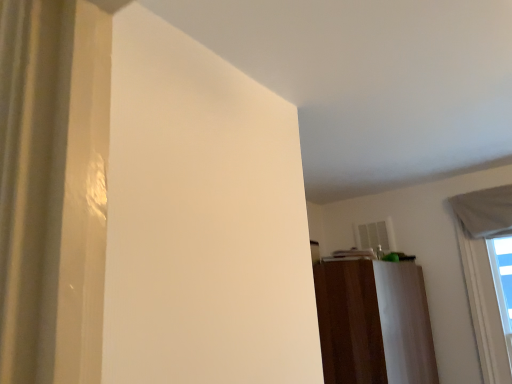
Question: From a real-world perspective, does white fabric window at upper right stand above brown wood dresser at center?

Choices:
 (A) no
 (B) yes

Answer: (B)

Question: Is white fabric window at upper right closer to the viewer compared to brown wood dresser at center?

Choices:
 (A) yes
 (B) no

Answer: (B)

Question: Is white fabric window at upper right bigger than brown wood dresser at center?

Choices:
 (A) yes
 (B) no

Answer: (B)

Question: Is white fabric window at upper right next to brown wood dresser at center and touching it?

Choices:
 (A) no
 (B) yes

Answer: (A)

Question: Is white fabric window at upper right taller than brown wood dresser at center?

Choices:
 (A) no
 (B) yes

Answer: (B)

Question: Is brown wood dresser at center surrounded by white fabric window at upper right?

Choices:
 (A) yes
 (B) no

Answer: (B)

Question: From a real-world perspective, does brown wood dresser at center sit lower than white fabric window at upper right?

Choices:
 (A) yes
 (B) no

Answer: (A)

Question: Does brown wood dresser at center lie behind white fabric window at upper right?

Choices:
 (A) yes
 (B) no

Answer: (B)

Question: From the image's perspective, is brown wood dresser at center on top of white fabric window at upper right?

Choices:
 (A) no
 (B) yes

Answer: (A)

Question: Can you confirm if brown wood dresser at center is wider than white fabric window at upper right?

Choices:
 (A) no
 (B) yes

Answer: (B)

Question: Can we say brown wood dresser at center lies outside white fabric window at upper right?

Choices:
 (A) no
 (B) yes

Answer: (B)

Question: Does brown wood dresser at center have a smaller size compared to white fabric window at upper right?

Choices:
 (A) no
 (B) yes

Answer: (A)

Question: Is point (464, 226) positioned closer to the camera than point (417, 266)?

Choices:
 (A) farther
 (B) closer

Answer: (B)